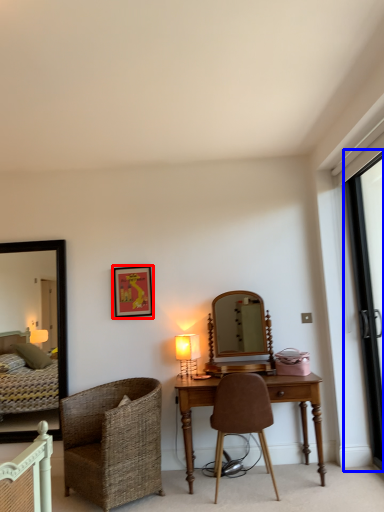
Question: Which point is further to the camera, picture frame (highlighted by a red box) or screen door (highlighted by a blue box)?

Choices:
 (A) picture frame
 (B) screen door

Answer: (A)